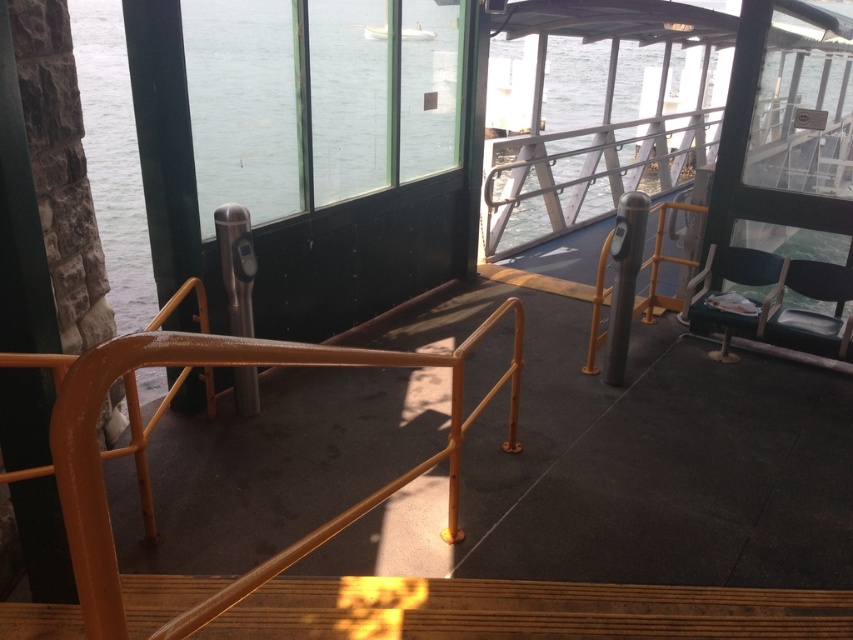
Between orange painted metal handrail at center and white glossy boat at upper center, which one has less height?

Standing shorter between the two is white glossy boat at upper center.

Can you confirm if orange painted metal handrail at center is smaller than white glossy boat at upper center?

Incorrect, orange painted metal handrail at center is not smaller in size than white glossy boat at upper center.

Where is `orange painted metal handrail at center`? The image size is (853, 640). orange painted metal handrail at center is located at coordinates (231, 364).

Can you confirm if orange painted metal handrail at center is positioned to the right of black leather chair at right?

In fact, orange painted metal handrail at center is to the left of black leather chair at right.

Is point (80, 419) more distant than point (828, 280)?

No, it is not.

Locate an element on the screen. orange painted metal handrail at center is located at coordinates (231, 364).

Is green fabric chair at right below white glossy boat at upper center?

Correct, green fabric chair at right is located below white glossy boat at upper center.

Is point (726, 360) positioned behind point (415, 28)?

No, (726, 360) is in front of (415, 28).

Where is `green fabric chair at right`? Image resolution: width=853 pixels, height=640 pixels. green fabric chair at right is located at coordinates (735, 294).